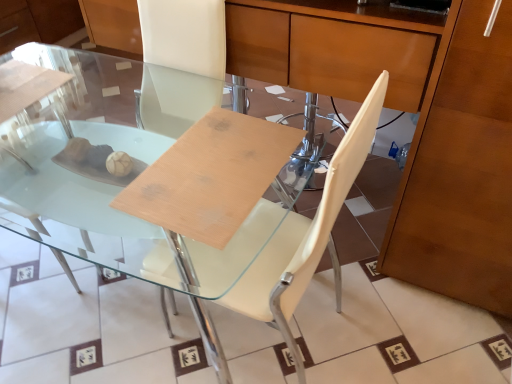
Question: Is transparent glass table at center inside the boundaries of white leather chair at center, or outside?

Choices:
 (A) outside
 (B) inside

Answer: (A)

Question: Looking at the image, does transparent glass table at center seem bigger or smaller compared to white leather chair at center?

Choices:
 (A) big
 (B) small

Answer: (A)

Question: Visually, is transparent glass table at center positioned to the left or to the right of white leather chair at center?

Choices:
 (A) right
 (B) left

Answer: (B)

Question: From a real-world perspective, is white leather chair at center physically located above or below transparent glass table at center?

Choices:
 (A) above
 (B) below

Answer: (A)

Question: Based on their sizes in the image, would you say white leather chair at center is bigger or smaller than transparent glass table at center?

Choices:
 (A) small
 (B) big

Answer: (A)

Question: Considering the positions of point (300, 372) and point (30, 127), is point (300, 372) closer or farther from the camera than point (30, 127)?

Choices:
 (A) closer
 (B) farther

Answer: (A)

Question: Is white leather chair at center taller or shorter than transparent glass table at center?

Choices:
 (A) tall
 (B) short

Answer: (A)